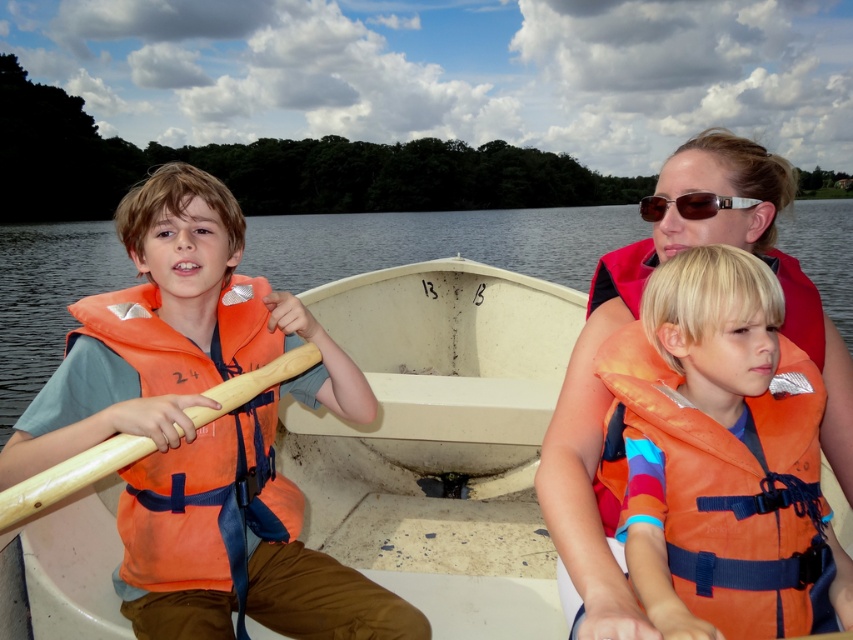
You are standing on the dock and looking at the white matte boat at center and the orange life vest at center in the water. Which object is closer to you?

The orange life vest at center is closer to you because it is positioned above the white matte boat at center, meaning it is nearer in the visual perspective.

You are a photographer on the boat and want to take a photo of the wooden paddle at left and sunglasses at center. Which object should you focus on first if you want to capture both in the frame without moving the camera?

The wooden paddle at left should be focused on first since it is taller than the sunglasses at center, allowing you to frame both objects effectively.

From the picture: What is located at the coordinates point (x=437, y=241) in the image?

The coordinates point (x=437, y=241) indicate transparent water at boat center.